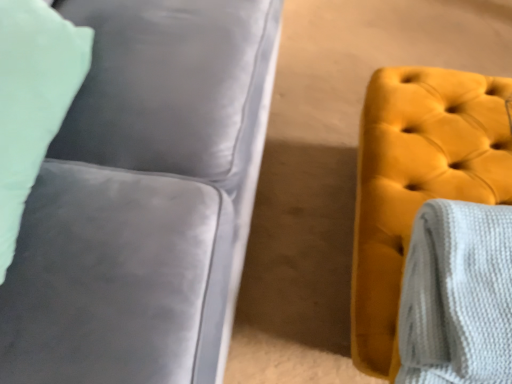
Where is `free spot behind velvet yellow ottoman at right`? free spot behind velvet yellow ottoman at right is located at coordinates (352, 69).